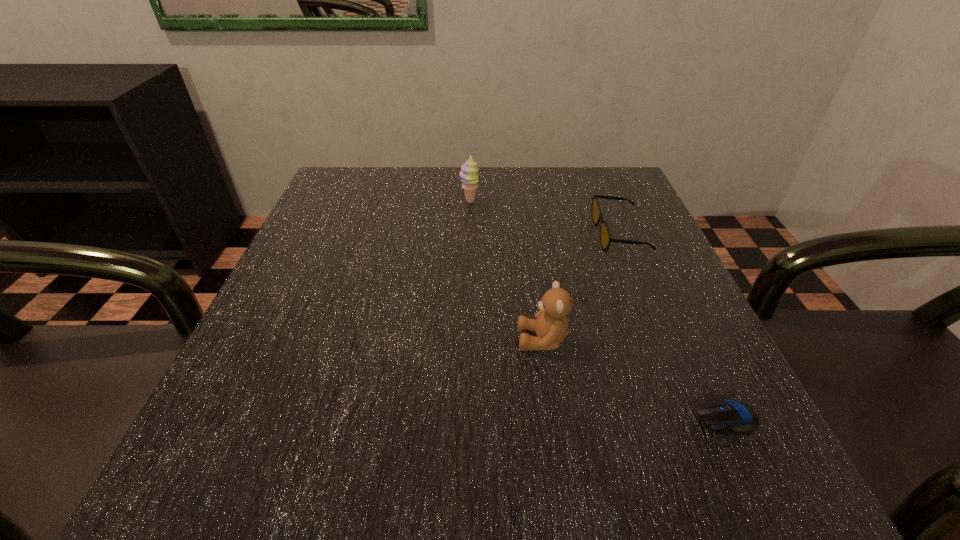
Identify the location of the leftmost object. The height and width of the screenshot is (540, 960). (469, 171).

This screenshot has width=960, height=540. Identify the location of the farthest object. (469, 171).

Locate an element on the screen. The height and width of the screenshot is (540, 960). the second nearest object is located at coordinates (551, 327).

Locate an element on the screen. The height and width of the screenshot is (540, 960). the third object from right to left is located at coordinates (551, 327).

Where is `the third nearest object`? Image resolution: width=960 pixels, height=540 pixels. the third nearest object is located at coordinates (605, 236).

The image size is (960, 540). I want to click on sunglasses, so click(605, 236).

What are the coordinates of `computer mouse` in the screenshot? It's located at (718, 413).

At what (x,y) coordinates should I click in order to perform the action: click on the shortest object. Please return your answer as a coordinate pair (x, y). Looking at the image, I should click on (718, 413).

This screenshot has width=960, height=540. In order to click on vacant space located 0.290m on the front of the farthest object in this screenshot , I will do `click(467, 295)`.

Find the location of a particular element. This screenshot has width=960, height=540. free region located on the face of the third object from right to left is located at coordinates (290, 340).